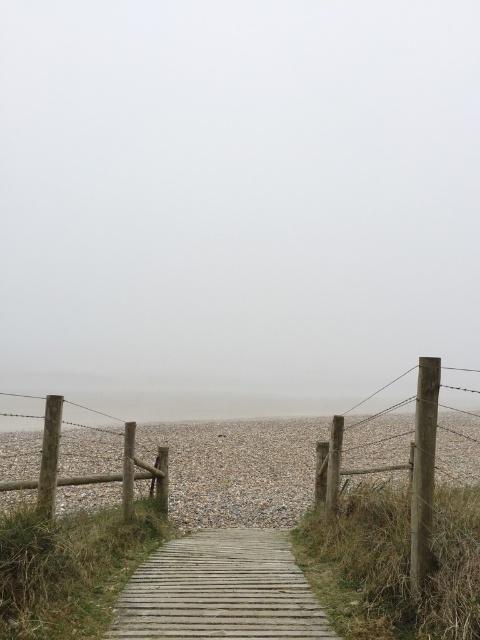
Is gray gravel at center thinner than wooden planks at center?

No, gray gravel at center is not thinner than wooden planks at center.

Which of these two, gray gravel at center or wooden planks at center, stands taller?

gray gravel at center is taller.

The width and height of the screenshot is (480, 640). Find the location of `gray gravel at center`. gray gravel at center is located at coordinates (237, 468).

Is wooden planks at center bigger than wooden fence at right?

Yes.

Is wooden planks at center wider than wooden fence at right?

Yes.

Identify the location of wooden planks at center. (219, 589).

Identify the location of wooden planks at center. The image size is (480, 640). (219, 589).

Which is in front, point (108, 497) or point (67, 480)?

Point (67, 480)

At what (x,y) coordinates should I click in order to perform the action: click on gray gravel at center. Please return your answer as a coordinate pair (x, y). Looking at the image, I should click on (237, 468).

Where is `gray gravel at center`? This screenshot has width=480, height=640. gray gravel at center is located at coordinates (237, 468).